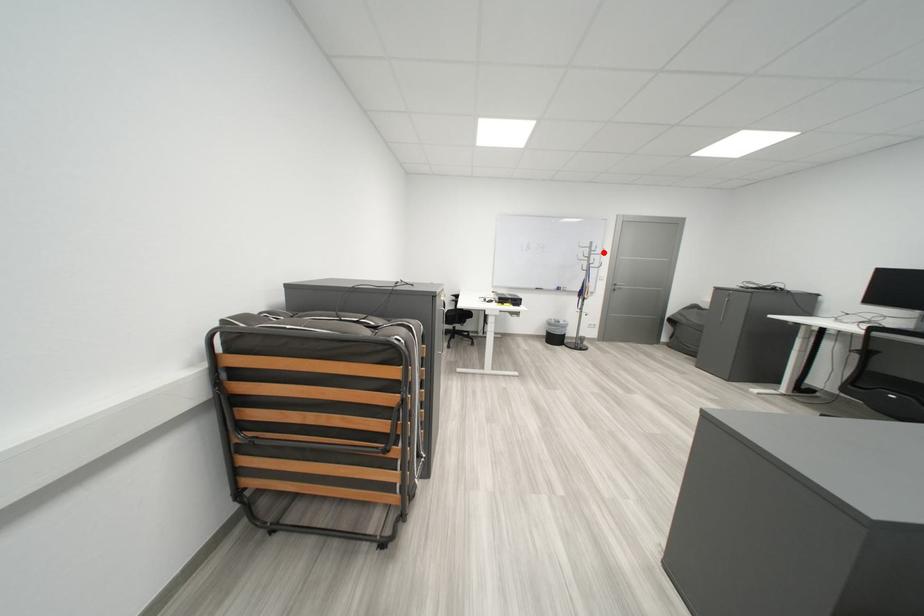
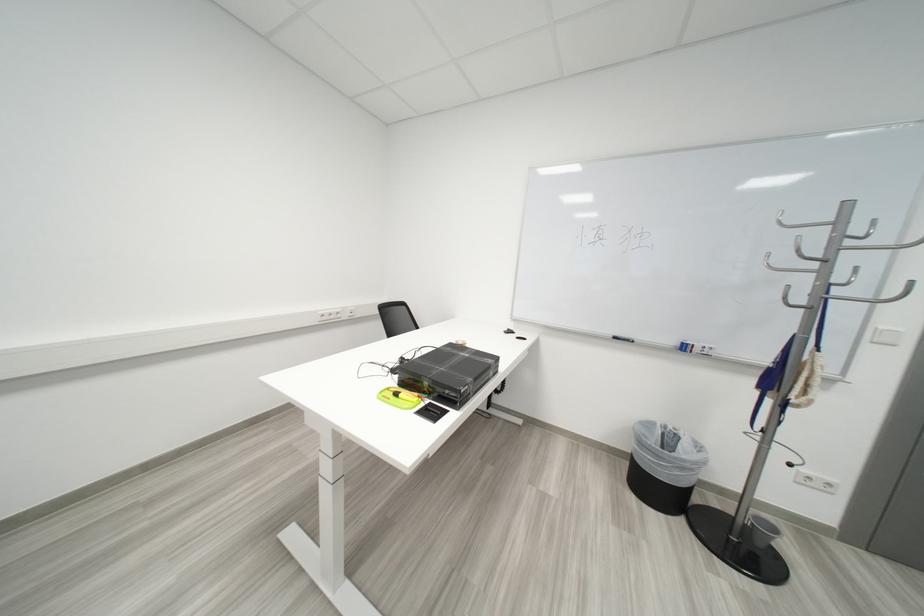
Question: I am providing you with two images of the same scene from different viewpoints. Given a red point in image1, look at the same physical point in image2. Is it:

Choices:
 (A) Closer to the viewpoint
 (B) Farther from the viewpoint

Answer: (B)